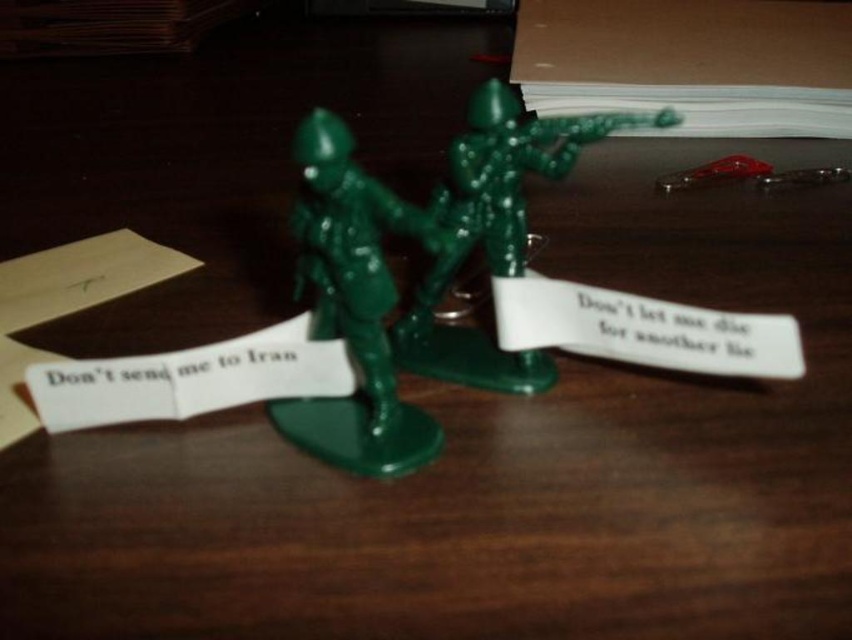
You are a photographer trying to capture the green plastic toy soldiers at center. What coordinates should you aim your camera at to ensure they are centered in the frame?

The green plastic toy soldiers at center are located at coordinates point (352, 307), so you should aim your camera at those coordinates to center them in the frame.

You are standing at the origin of the coordinate system. You see two points, point (320, 308) and point (429, 320). Which point is closer to you?

Point (320, 308) is closer to you because it is in front of point (429, 320).